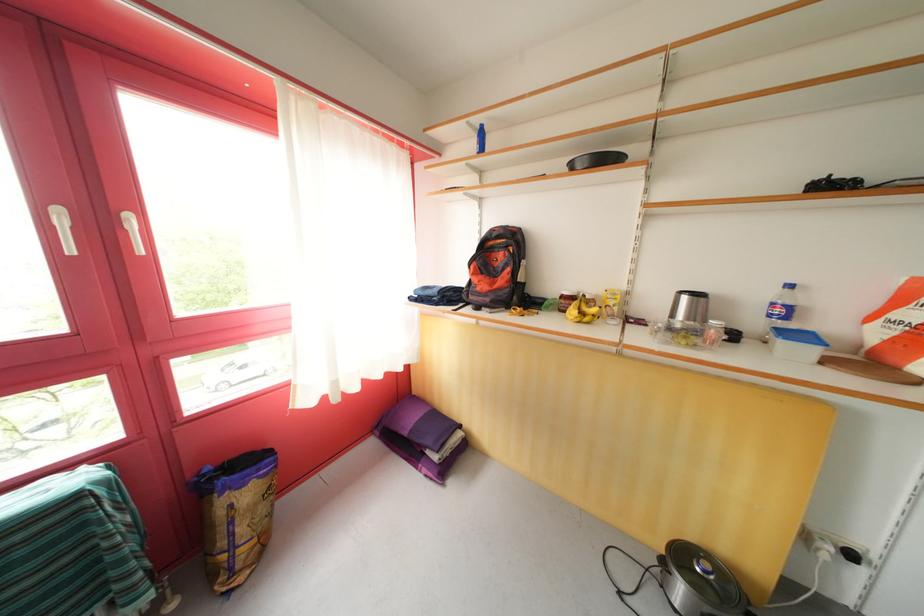
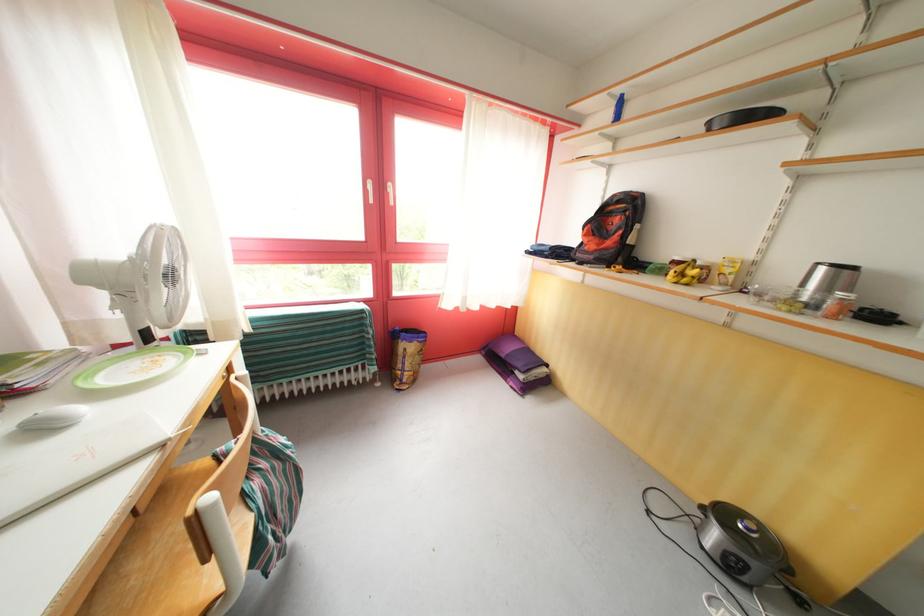
Where in the second image is the point corresponding to (x=573, y=299) from the first image?

(684, 264)